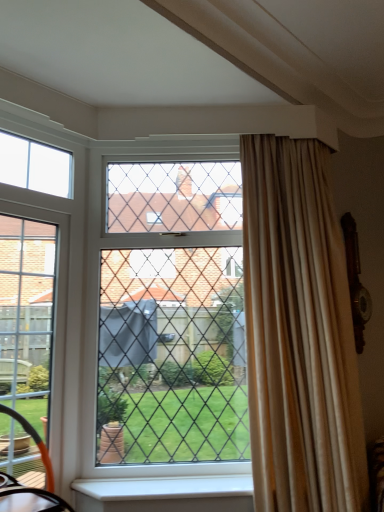
Question: From a real-world perspective, is clear glass window at center physically located above or below beige silk curtain at right?

Choices:
 (A) above
 (B) below

Answer: (A)

Question: Is clear glass window at center taller or shorter than beige silk curtain at right?

Choices:
 (A) tall
 (B) short

Answer: (B)

Question: Which object is positioned farthest from the clear glass screen door at left?

Choices:
 (A) beige silk curtain at right
 (B) clear glass window at upper left
 (C) clear glass window at center
 (D) white smooth window sill at lower center

Answer: (A)

Question: Considering the real-world distances, which object is closest to the white smooth window sill at lower center?

Choices:
 (A) beige silk curtain at right
 (B) clear glass window at center
 (C) clear glass window at upper left
 (D) clear glass screen door at left

Answer: (B)